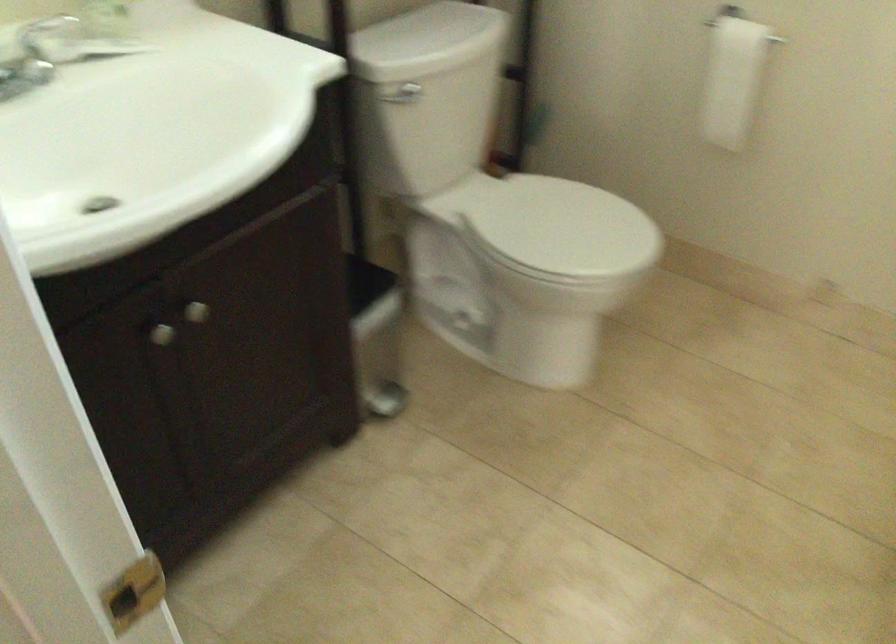
Find where to lift the white toilet lid. Please return your answer as a coordinate pair (x, y).

(564, 225)